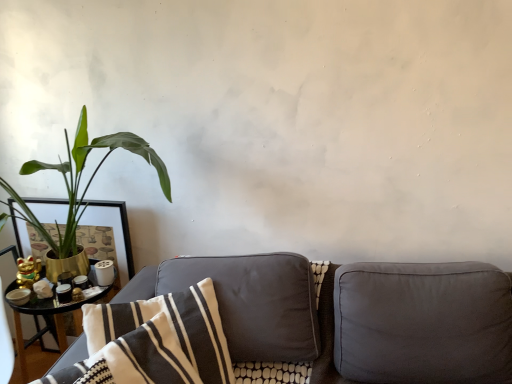
Question: Is gold metallic pot at left not close to suede gray couch at lower center?

Choices:
 (A) no
 (B) yes

Answer: (A)

Question: Is gold metallic pot at left at the left side of suede gray couch at lower center?

Choices:
 (A) yes
 (B) no

Answer: (A)

Question: From a real-world perspective, is gold metallic pot at left below suede gray couch at lower center?

Choices:
 (A) no
 (B) yes

Answer: (A)

Question: Can you confirm if gold metallic pot at left is positioned to the right of suede gray couch at lower center?

Choices:
 (A) no
 (B) yes

Answer: (A)

Question: Is gold metallic pot at left facing towards suede gray couch at lower center?

Choices:
 (A) no
 (B) yes

Answer: (A)

Question: Is gold metallic pot at left wider than suede gray couch at lower center?

Choices:
 (A) yes
 (B) no

Answer: (B)

Question: Does suede gray couch at lower center have a smaller size compared to white striped fabric pillow at center, acting as the first pillow starting from the left?

Choices:
 (A) no
 (B) yes

Answer: (A)

Question: From the image's perspective, is suede gray couch at lower center located above white striped fabric pillow at center, acting as the first pillow starting from the left?

Choices:
 (A) yes
 (B) no

Answer: (B)

Question: Is the position of suede gray couch at lower center less distant than that of white striped fabric pillow at center, positioned as the second pillow in right-to-left order?

Choices:
 (A) yes
 (B) no

Answer: (B)

Question: Is suede gray couch at lower center wider than white striped fabric pillow at center, positioned as the second pillow in right-to-left order?

Choices:
 (A) no
 (B) yes

Answer: (B)

Question: From a real-world perspective, is suede gray couch at lower center positioned over white striped fabric pillow at center, acting as the first pillow starting from the left, based on gravity?

Choices:
 (A) no
 (B) yes

Answer: (A)

Question: Is suede gray couch at lower center further to the viewer compared to white striped fabric pillow at center, acting as the first pillow starting from the left?

Choices:
 (A) no
 (B) yes

Answer: (B)

Question: From the image's perspective, is suede gray couch at lower center below suede-like gray pillow at right, acting as the first pillow starting from the right?

Choices:
 (A) no
 (B) yes

Answer: (B)